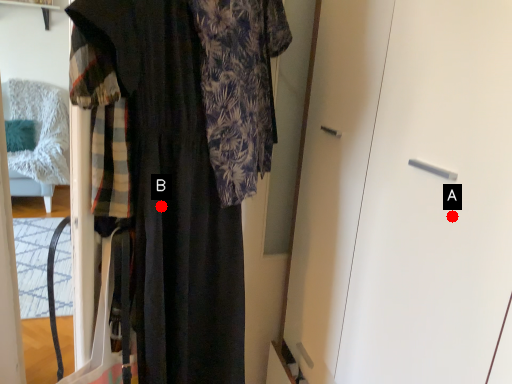
Question: Two points are circled on the image, labeled by A and B beside each circle. Which point is farther from the camera taking this photo?

Choices:
 (A) A is further
 (B) B is further

Answer: (B)